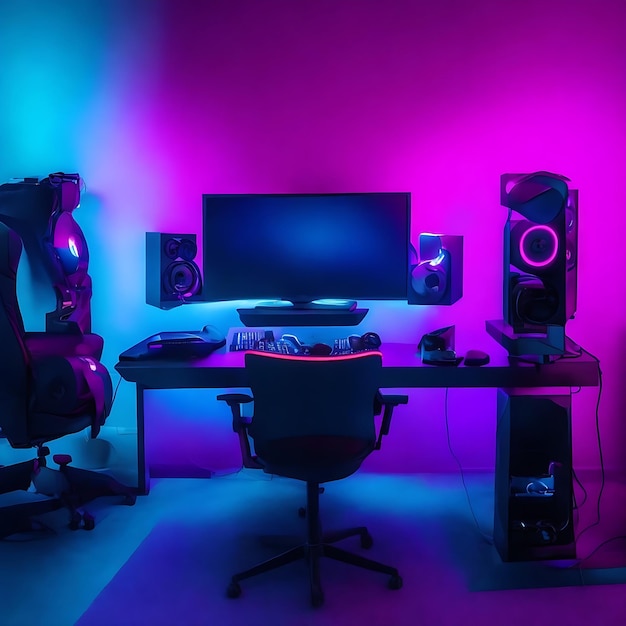
Where is `computer chair arm rests`? computer chair arm rests is located at coordinates (46, 347), (239, 399), (399, 402).